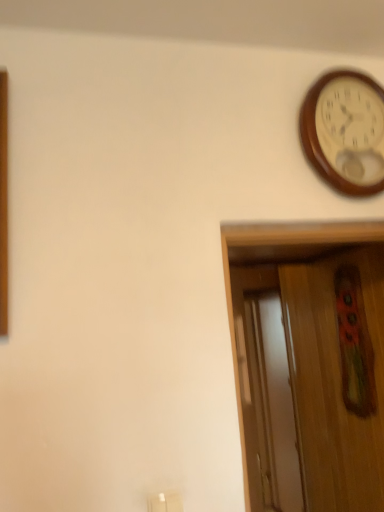
Image resolution: width=384 pixels, height=512 pixels. What do you see at coordinates (345, 131) in the screenshot? I see `wooden/polished wall clock at upper right` at bounding box center [345, 131].

I want to click on wooden/polished wall clock at upper right, so click(345, 131).

Find the location of a particular element. This screenshot has width=384, height=512. wooden/polished wall clock at upper right is located at coordinates (345, 131).